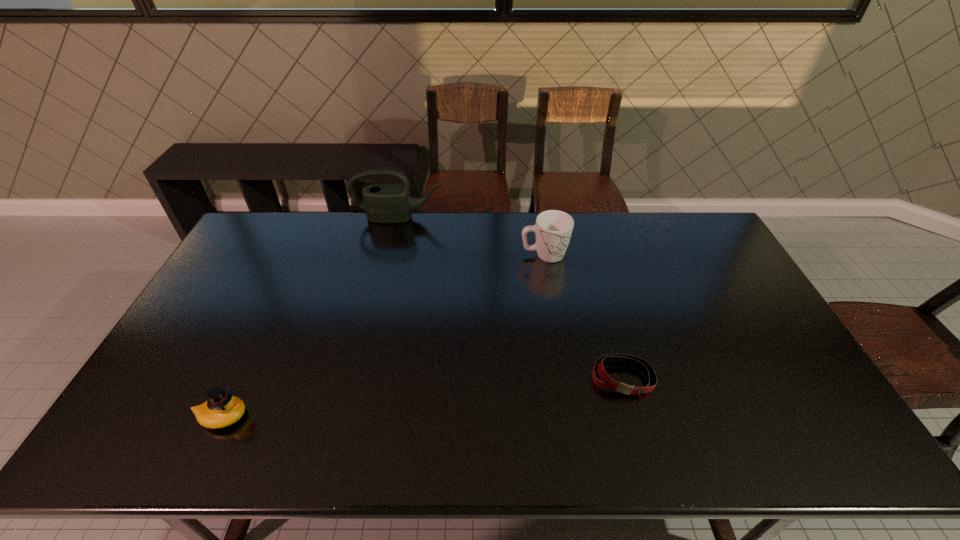
Locate an element on the screen. Image resolution: width=960 pixels, height=540 pixels. free spot between the mug and the tallest object is located at coordinates (471, 237).

Where is `vacant space that is in between the nearest object and the third object from right to left`? vacant space that is in between the nearest object and the third object from right to left is located at coordinates (311, 317).

Find the location of a particular element. The height and width of the screenshot is (540, 960). empty space between the tallest object and the duck is located at coordinates (311, 317).

Find the location of a particular element. The width and height of the screenshot is (960, 540). free spot between the mug and the third object from right to left is located at coordinates (471, 237).

Identify the location of blank region between the mug and the third tallest object. (384, 336).

Locate an element on the screen. The width and height of the screenshot is (960, 540). vacant point located between the second object from left to right and the third farthest object is located at coordinates (511, 298).

This screenshot has height=540, width=960. I want to click on vacant region between the second object from left to right and the dog collar, so click(x=511, y=298).

Where is `empty space between the nearest object and the shortest object`? This screenshot has width=960, height=540. empty space between the nearest object and the shortest object is located at coordinates (423, 397).

This screenshot has width=960, height=540. What are the coordinates of `free spot between the second shortest object and the dog collar` in the screenshot? It's located at (423, 397).

You are a GUI agent. You are given a task and a screenshot of the screen. Output one action in this format:
    pyautogui.click(x=<x>, y=<y>)
    Task: Click on the closest object to the mug
    The image size is (960, 540).
    Given the screenshot: What is the action you would take?
    pyautogui.click(x=384, y=203)